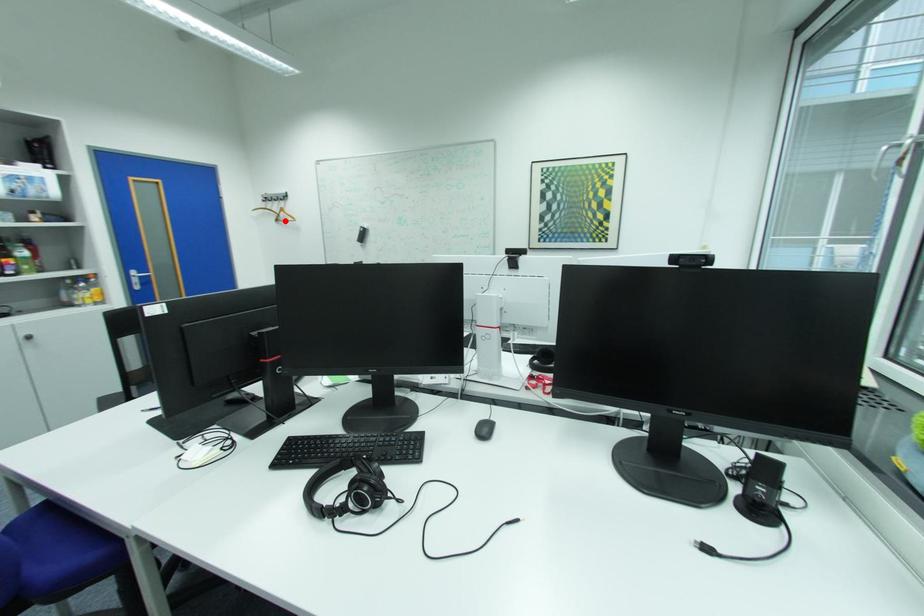
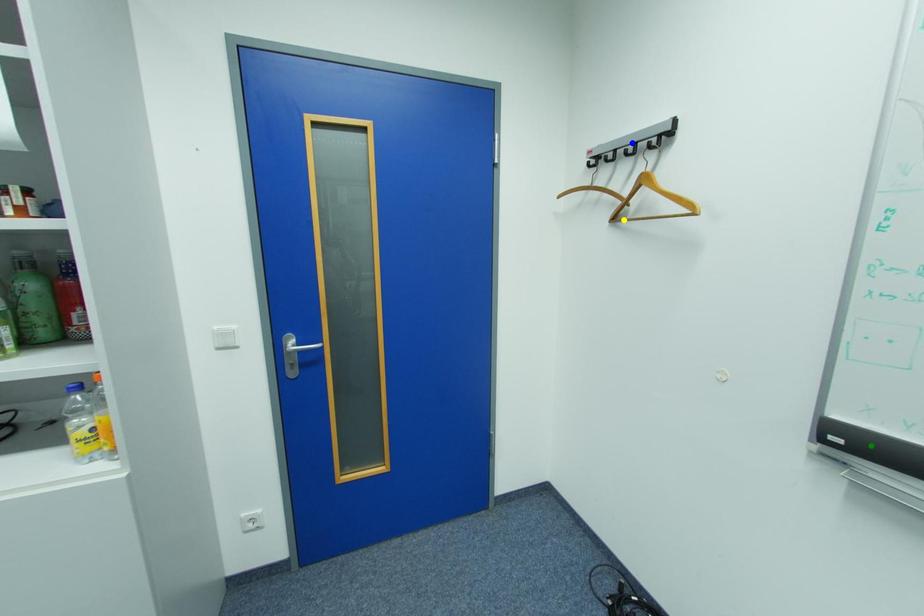
Question: I am providing you with two images of the same scene from different viewpoints. A red point is marked on the first image. You are given multiple points on the second image. Which point in image 2 is actually the same real-world point as the red point in image 1?

Choices:
 (A) yellow point
 (B) green point
 (C) blue point

Answer: (A)